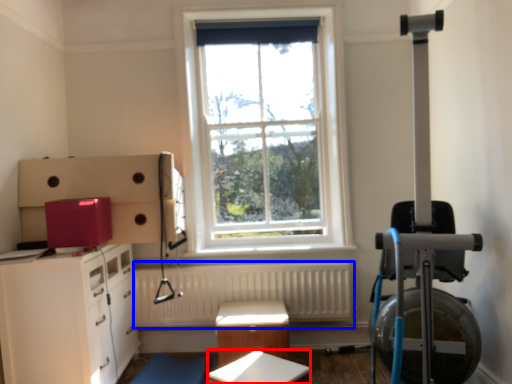
Question: Among these objects, which one is nearest to the camera, table (highlighted by a red box) or radiator (highlighted by a blue box)?

Choices:
 (A) table
 (B) radiator

Answer: (A)